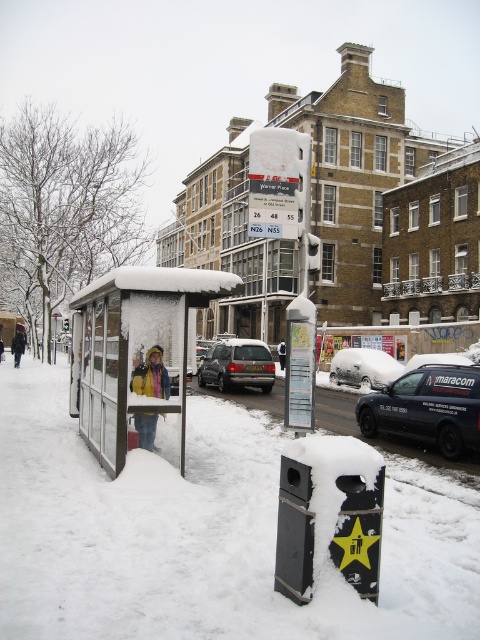
You are a delivery person trying to decide whether to place a large package next to the black plastic trash can at lower center. The package is as tall as the yellow fabric jacket at left. Will the package fit in the space next to the trash can without exceeding its height?

The black plastic trash can at lower center is shorter than the yellow fabric jacket at left. Since the package is as tall as the yellow fabric jacket at left, it will exceed the height of the trash can. Therefore, the package may not fit without exceeding the trash can height.